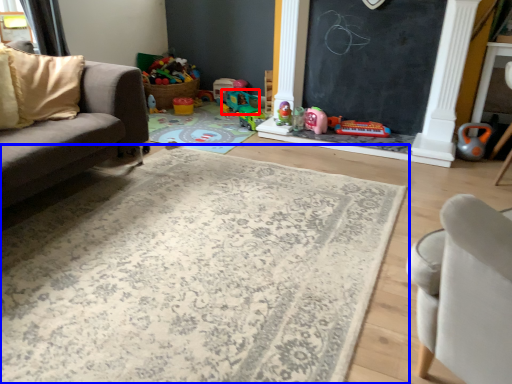
Question: Which point is closer to the camera, toy (highlighted by a red box) or mat (highlighted by a blue box)?

Choices:
 (A) toy
 (B) mat

Answer: (B)